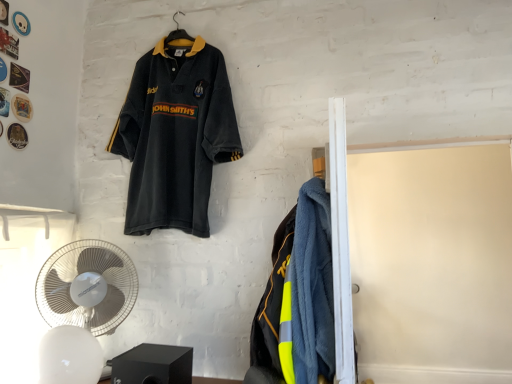
The height and width of the screenshot is (384, 512). I want to click on white plastic fan at lower left, which ranks as the 2th mechanical fan in front-to-back order, so click(87, 286).

What do you see at coordinates (70, 356) in the screenshot? I see `white plastic mechanical fan at lower left, positioned as the 2th mechanical fan in back-to-front order` at bounding box center [70, 356].

Identify the location of white plastic fan at lower left, which ranks as the 2th mechanical fan in front-to-back order. (87, 286).

Is velvet-like dark blue polo shirt at upper left to the left of white plastic mechanical fan at lower left, the 1th mechanical fan from the front, from the viewer's perspective?

Incorrect, velvet-like dark blue polo shirt at upper left is not on the left side of white plastic mechanical fan at lower left, the 1th mechanical fan from the front.

Is there a large distance between velvet-like dark blue polo shirt at upper left and white plastic mechanical fan at lower left, the 1th mechanical fan from the front?

No, velvet-like dark blue polo shirt at upper left is not far away from white plastic mechanical fan at lower left, the 1th mechanical fan from the front.

From a real-world perspective, is velvet-like dark blue polo shirt at upper left physically located above or below white plastic mechanical fan at lower left, positioned as the 2th mechanical fan in back-to-front order?

velvet-like dark blue polo shirt at upper left is situated higher than white plastic mechanical fan at lower left, positioned as the 2th mechanical fan in back-to-front order, in the real world.

Is velvet-like dark blue polo shirt at upper left oriented towards white plastic mechanical fan at lower left, the 1th mechanical fan from the front?

No.

Considering the sizes of objects white plastic mechanical fan at lower left, positioned as the 2th mechanical fan in back-to-front order, and white plastic fan at lower left, which ranks as the 2th mechanical fan in front-to-back order, in the image provided, who is wider, white plastic mechanical fan at lower left, positioned as the 2th mechanical fan in back-to-front order, or white plastic fan at lower left, which ranks as the 2th mechanical fan in front-to-back order,?

white plastic mechanical fan at lower left, positioned as the 2th mechanical fan in back-to-front order, is wider.

From a real-world perspective, is white plastic mechanical fan at lower left, the 1th mechanical fan from the front, positioned over white plastic fan at lower left, which ranks as the 2th mechanical fan in front-to-back order, based on gravity?

No.

The image size is (512, 384). Identify the location of mechanical fan behind the white plastic mechanical fan at lower left, the 1th mechanical fan from the front. (87, 286).

Which is correct: white plastic mechanical fan at lower left, the 1th mechanical fan from the front, is inside white plastic fan at lower left, the 1th mechanical fan in the back-to-front sequence, or outside of it?

The correct answer is: outside.

From the picture: From a real-world perspective, who is located higher, white plastic fan at lower left, which ranks as the 2th mechanical fan in front-to-back order, or white plastic mechanical fan at lower left, the 1th mechanical fan from the front?

In real-world perspective, white plastic fan at lower left, which ranks as the 2th mechanical fan in front-to-back order, is above.

Is white plastic fan at lower left, the 1th mechanical fan in the back-to-front sequence, far from white plastic mechanical fan at lower left, the 1th mechanical fan from the front?

No, there isn't a large distance between white plastic fan at lower left, the 1th mechanical fan in the back-to-front sequence, and white plastic mechanical fan at lower left, the 1th mechanical fan from the front.

Would you say white plastic mechanical fan at lower left, positioned as the 2th mechanical fan in back-to-front order, is part of white plastic fan at lower left, the 1th mechanical fan in the back-to-front sequence,'s contents?

That's incorrect, white plastic mechanical fan at lower left, positioned as the 2th mechanical fan in back-to-front order, is not inside white plastic fan at lower left, the 1th mechanical fan in the back-to-front sequence.

Between white plastic fan at lower left, the 1th mechanical fan in the back-to-front sequence, and white plastic mechanical fan at lower left, the 1th mechanical fan from the front, which one is positioned behind?

white plastic fan at lower left, the 1th mechanical fan in the back-to-front sequence, is more distant.

What's the angular difference between velvet-like dark blue polo shirt at upper left and white plastic fan at lower left, which ranks as the 2th mechanical fan in front-to-back order,'s facing directions?

There is a 29.9-degree angle between the facing directions of velvet-like dark blue polo shirt at upper left and white plastic fan at lower left, which ranks as the 2th mechanical fan in front-to-back order.

Can white plastic fan at lower left, which ranks as the 2th mechanical fan in front-to-back order, be found inside velvet-like dark blue polo shirt at upper left?

No.

Which of these two, velvet-like dark blue polo shirt at upper left or white plastic fan at lower left, which ranks as the 2th mechanical fan in front-to-back order, is bigger?

Bigger between the two is velvet-like dark blue polo shirt at upper left.

Can you confirm if velvet-like dark blue polo shirt at upper left is positioned to the right of white plastic fan at lower left, the 1th mechanical fan in the back-to-front sequence?

Indeed, velvet-like dark blue polo shirt at upper left is positioned on the right side of white plastic fan at lower left, the 1th mechanical fan in the back-to-front sequence.

From a real-world perspective, is white plastic fan at lower left, which ranks as the 2th mechanical fan in front-to-back order, physically located above or below velvet-like dark blue polo shirt at upper left?

white plastic fan at lower left, which ranks as the 2th mechanical fan in front-to-back order, is below velvet-like dark blue polo shirt at upper left.

Considering the relative positions of white plastic fan at lower left, the 1th mechanical fan in the back-to-front sequence, and velvet-like dark blue polo shirt at upper left in the image provided, is white plastic fan at lower left, the 1th mechanical fan in the back-to-front sequence, behind velvet-like dark blue polo shirt at upper left?

No, white plastic fan at lower left, the 1th mechanical fan in the back-to-front sequence, is closer to the camera.

Does white plastic fan at lower left, which ranks as the 2th mechanical fan in front-to-back order, appear on the right side of velvet-like dark blue polo shirt at upper left?

No, white plastic fan at lower left, which ranks as the 2th mechanical fan in front-to-back order, is not to the right of velvet-like dark blue polo shirt at upper left.

Is white plastic mechanical fan at lower left, the 1th mechanical fan from the front, with velvet-like dark blue polo shirt at upper left?

No, white plastic mechanical fan at lower left, the 1th mechanical fan from the front, is not in contact with velvet-like dark blue polo shirt at upper left.

Is the depth of white plastic mechanical fan at lower left, the 1th mechanical fan from the front, less than that of velvet-like dark blue polo shirt at upper left?

Yes, it is in front of velvet-like dark blue polo shirt at upper left.

Where is `mechanical fan that is the 2nd one when counting forward from the velvet-like dark blue polo shirt at upper left`? mechanical fan that is the 2nd one when counting forward from the velvet-like dark blue polo shirt at upper left is located at coordinates (70, 356).

This screenshot has height=384, width=512. There is a velvet-like dark blue polo shirt at upper left. Find the location of `the 2nd mechanical fan below it (from a real-world perspective)`. the 2nd mechanical fan below it (from a real-world perspective) is located at coordinates (70, 356).

There is a white plastic mechanical fan at lower left, the 1th mechanical fan from the front. Where is `mechanical fan above it (from a real-world perspective)`? mechanical fan above it (from a real-world perspective) is located at coordinates (87, 286).

Estimate the real-world distances between objects in this image. Which object is further from white plastic mechanical fan at lower left, positioned as the 2th mechanical fan in back-to-front order, velvet-like dark blue polo shirt at upper left or white plastic fan at lower left, which ranks as the 2th mechanical fan in front-to-back order?

velvet-like dark blue polo shirt at upper left is further to white plastic mechanical fan at lower left, positioned as the 2th mechanical fan in back-to-front order.

In the scene shown: Based on their spatial positions, is white plastic mechanical fan at lower left, positioned as the 2th mechanical fan in back-to-front order, or velvet-like dark blue polo shirt at upper left closer to white plastic fan at lower left, the 1th mechanical fan in the back-to-front sequence?

white plastic mechanical fan at lower left, positioned as the 2th mechanical fan in back-to-front order, lies closer to white plastic fan at lower left, the 1th mechanical fan in the back-to-front sequence, than the other object.

Estimate the real-world distances between objects in this image. Which object is further from velvet-like dark blue polo shirt at upper left, white plastic mechanical fan at lower left, the 1th mechanical fan from the front, or white plastic fan at lower left, the 1th mechanical fan in the back-to-front sequence?

Based on the image, white plastic mechanical fan at lower left, the 1th mechanical fan from the front, appears to be further to velvet-like dark blue polo shirt at upper left.

Estimate the real-world distances between objects in this image. Which object is closer to velvet-like dark blue polo shirt at upper left, white plastic fan at lower left, the 1th mechanical fan in the back-to-front sequence, or white plastic mechanical fan at lower left, the 1th mechanical fan from the front?

Based on the image, white plastic fan at lower left, the 1th mechanical fan in the back-to-front sequence, appears to be nearer to velvet-like dark blue polo shirt at upper left.

Based on their spatial positions, is velvet-like dark blue polo shirt at upper left or white plastic mechanical fan at lower left, positioned as the 2th mechanical fan in back-to-front order, closer to white plastic fan at lower left, the 1th mechanical fan in the back-to-front sequence?

white plastic mechanical fan at lower left, positioned as the 2th mechanical fan in back-to-front order, is closer to white plastic fan at lower left, the 1th mechanical fan in the back-to-front sequence.

Looking at the image, which one is located closer to white plastic mechanical fan at lower left, the 1th mechanical fan from the front, white plastic fan at lower left, the 1th mechanical fan in the back-to-front sequence, or velvet-like dark blue polo shirt at upper left?

Based on the image, white plastic fan at lower left, the 1th mechanical fan in the back-to-front sequence, appears to be nearer to white plastic mechanical fan at lower left, the 1th mechanical fan from the front.

The width and height of the screenshot is (512, 384). In order to click on mechanical fan between velvet-like dark blue polo shirt at upper left and white plastic mechanical fan at lower left, the 1th mechanical fan from the front, from top to bottom in this screenshot , I will do `click(87, 286)`.